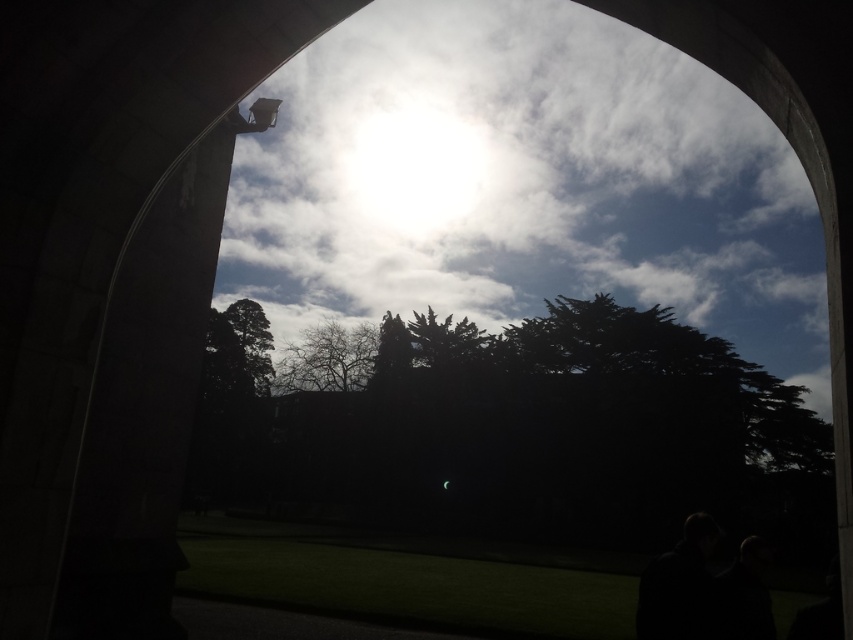
Question: Considering the relative positions of green leafy tree at center and bare branches at center in the image provided, where is green leafy tree at center located with respect to bare branches at center?

Choices:
 (A) above
 (B) below

Answer: (B)

Question: Which of the following is the farthest from the observer?

Choices:
 (A) bare branches at center
 (B) green leafy tree at center

Answer: (A)

Question: Which object is closer to the camera taking this photo?

Choices:
 (A) green leafy tree at center
 (B) bare branches at center

Answer: (A)

Question: Is green leafy tree at center positioned behind bare branches at center?

Choices:
 (A) yes
 (B) no

Answer: (B)

Question: Does green leafy tree at center appear on the left side of bare branches at center?

Choices:
 (A) no
 (B) yes

Answer: (A)

Question: Which of the following is the farthest from the observer?

Choices:
 (A) (413, 314)
 (B) (316, 376)

Answer: (B)